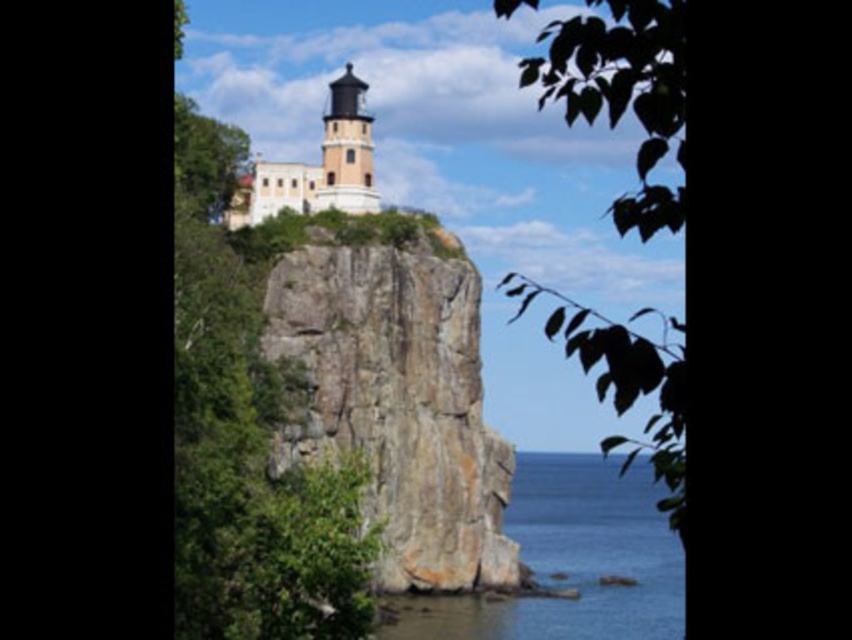
You are a bird flying over the coastal area and want to land on the white stone tower at upper center. There is a green leafy tree at upper left nearby. Do you think you can fly from the tree to the tower without needing to flap your wings? Assume you can glide for up to 15 meters without flapping.

The distance between the green leafy tree at upper left and the white stone tower at upper center is 14.69 meters. Since your gliding range is up to 15 meters, you can glide from the tree to the tower without flapping your wings.

You are standing at the base of the cliff looking up at the lighthouse. There are two points marked on the cliff face. One is at coordinates point (383,323) and the other at point (331,129). Which of these two points is closer to you?

Point (383,323) is closer to the camera than point (331,129), so the point at coordinates point (383,323) is closer to you.

You are standing at the base of the rugged cliff in the coastal scene and want to locate the exact point marked as point (320, 164). According to the image, where exactly is this point located?

The point (320, 164) is located on the white stone tower at upper center.